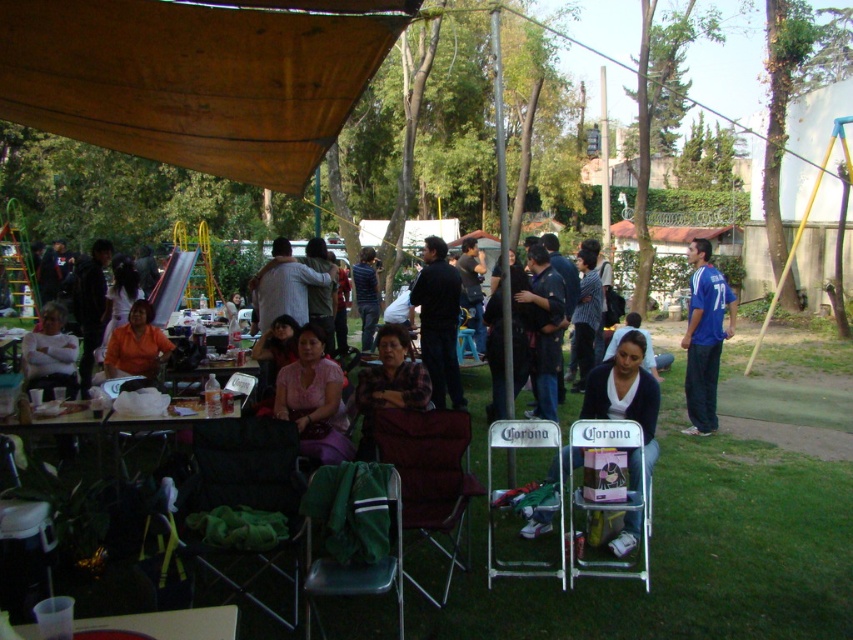
Question: Is wooden table at center smaller than orange matte shirt at center?

Choices:
 (A) no
 (B) yes

Answer: (A)

Question: Estimate the real-world distances between objects in this image. Which object is farther from the white plastic chair at center?

Choices:
 (A) matte white shirt at left
 (B) clear plastic cup at lower left
 (C) matte pink shirt at center

Answer: (A)

Question: In this image, where is brown fabric canopy at upper left located relative to dark green fabric chair at lower left?

Choices:
 (A) below
 (B) above

Answer: (B)

Question: Which of the following is the farthest from the observer?

Choices:
 (A) (132, 145)
 (B) (204, 426)

Answer: (A)

Question: Which of the following is the farthest from the observer?

Choices:
 (A) pink matte shirt at center
 (B) green fabric chair at lower left

Answer: (A)

Question: Is dark green fabric chair at lower left below pink matte shirt at center?

Choices:
 (A) no
 (B) yes

Answer: (B)